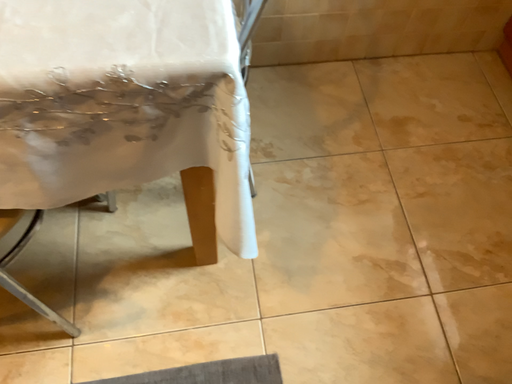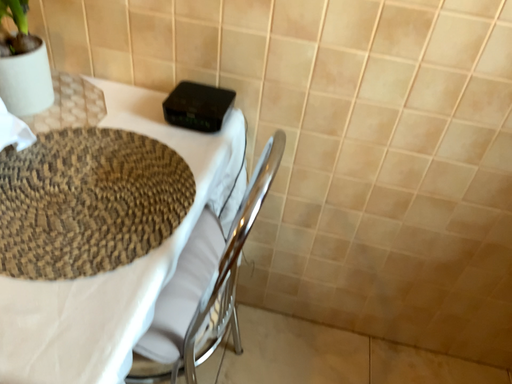
Question: Which way did the camera rotate in the video?

Choices:
 (A) rotated downward
 (B) rotated upward

Answer: (B)